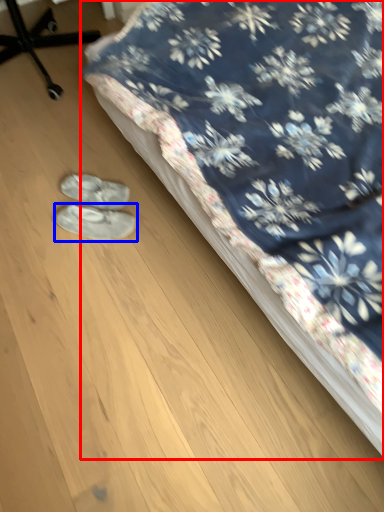
Question: Among these objects, which one is nearest to the camera, bed (highlighted by a red box) or footwear (highlighted by a blue box)?

Choices:
 (A) bed
 (B) footwear

Answer: (A)